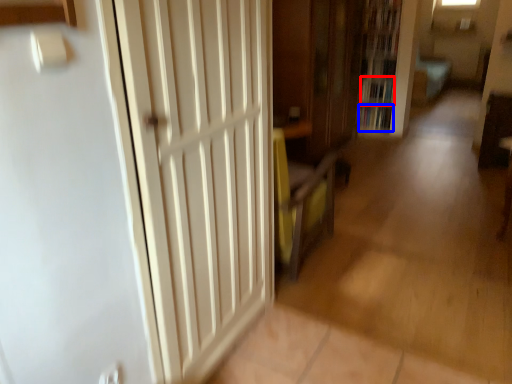
Question: Which object appears farthest to the camera in this image, book (highlighted by a red box) or book (highlighted by a blue box)?

Choices:
 (A) book
 (B) book

Answer: (B)